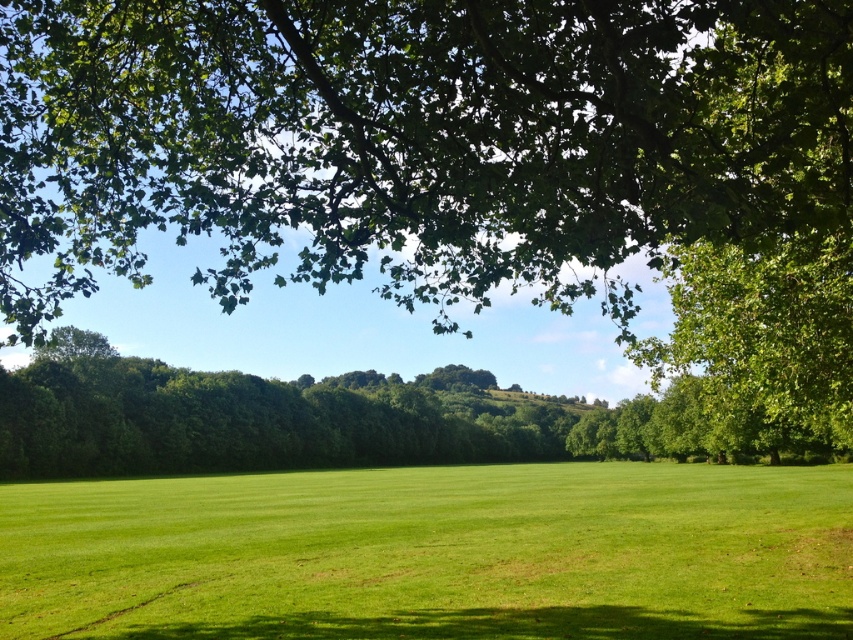
Is green leafy tree at upper center below green grass at center?

No.

Locate an element on the screen. green leafy tree at upper center is located at coordinates (413, 138).

At what (x,y) coordinates should I click in order to perform the action: click on green leafy tree at upper center. Please return your answer as a coordinate pair (x, y). The height and width of the screenshot is (640, 853). Looking at the image, I should click on (413, 138).

Is point (641, 125) positioned behind point (653, 422)?

No, (641, 125) is in front of (653, 422).

Who is positioned more to the left, green leafy tree at upper center or green leafy tree at upper right?

From the viewer's perspective, green leafy tree at upper center appears more on the left side.

Measure the distance between point (x=648, y=141) and camera.

Point (x=648, y=141) is 7.68 meters away from camera.

Find the location of a particular element. The image size is (853, 640). green leafy tree at upper center is located at coordinates (413, 138).

Is green grass at center to the right of green leafy tree at upper right from the viewer's perspective?

In fact, green grass at center is to the left of green leafy tree at upper right.

Can you confirm if green grass at center is positioned below green leafy tree at upper right?

Yes, green grass at center is below green leafy tree at upper right.

You are a GUI agent. You are given a task and a screenshot of the screen. Output one action in this format:
    pyautogui.click(x=<x>, y=<y>)
    Task: Click on the green grass at center
    The image size is (853, 640).
    Given the screenshot: What is the action you would take?
    pyautogui.click(x=434, y=554)